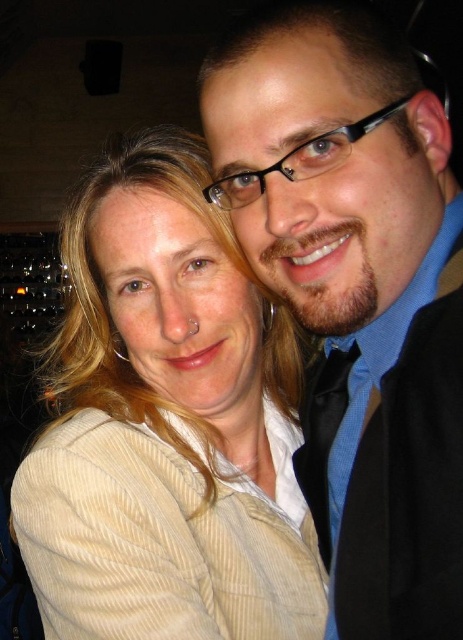
Can you confirm if beige corduroy jacket at upper left is positioned to the right of matte black suit at right?

In fact, beige corduroy jacket at upper left is to the left of matte black suit at right.

Between beige corduroy jacket at upper left and matte black suit at right, which one appears on the right side from the viewer's perspective?

matte black suit at right is more to the right.

Which is behind, point (175, 605) or point (369, 116)?

The point (175, 605) is behind.

You are a GUI agent. You are given a task and a screenshot of the screen. Output one action in this format:
    pyautogui.click(x=<x>, y=<y>)
    Task: Click on the beige corduroy jacket at upper left
    
    Given the screenshot: What is the action you would take?
    pyautogui.click(x=167, y=424)